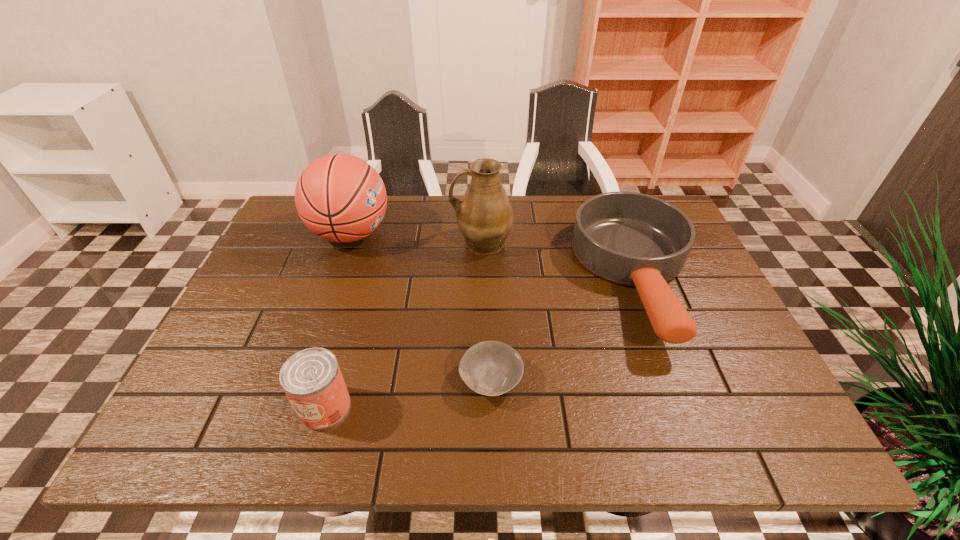
Locate an element on the screen. The image size is (960, 540). pitcher is located at coordinates (484, 215).

What are the coordinates of `basketball` in the screenshot? It's located at [x=340, y=197].

You are a GUI agent. You are given a task and a screenshot of the screen. Output one action in this format:
    pyautogui.click(x=<x>, y=<y>)
    Task: Click on the can
    The height and width of the screenshot is (540, 960).
    Given the screenshot: What is the action you would take?
    pyautogui.click(x=312, y=380)

I want to click on the rightmost object, so click(633, 239).

At what (x,y) coordinates should I click in order to perform the action: click on the shortest object. Please return your answer as a coordinate pair (x, y). This screenshot has height=540, width=960. Looking at the image, I should click on (492, 368).

This screenshot has width=960, height=540. What are the coordinates of `vacant space located 0.150m on the handle side of the pitcher` in the screenshot? It's located at (399, 242).

Image resolution: width=960 pixels, height=540 pixels. What are the coordinates of `free space located 0.280m on the handle side of the pitcher` in the screenshot? It's located at (354, 242).

Where is `vacant space situated 0.340m on the handle side of the pitcher`? The height and width of the screenshot is (540, 960). vacant space situated 0.340m on the handle side of the pitcher is located at coordinates (333, 242).

In order to click on vacant area situated on the logo side of the basketball in this screenshot , I will do `click(515, 234)`.

The height and width of the screenshot is (540, 960). Identify the location of vacant area located 0.230m on the left of the can. (184, 407).